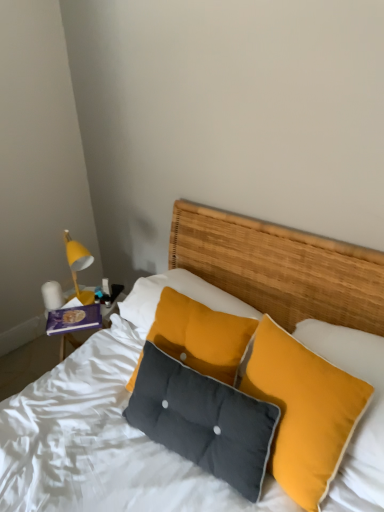
Question: Does white glossy lamp at left appear on the right side of dark gray fabric pillow at center, the second pillow when ordered from right to left?

Choices:
 (A) yes
 (B) no

Answer: (B)

Question: Considering the relative positions of white glossy lamp at left and dark gray fabric pillow at center, positioned as the first pillow in left-to-right order, in the image provided, is white glossy lamp at left in front of dark gray fabric pillow at center, positioned as the first pillow in left-to-right order,?

Choices:
 (A) yes
 (B) no

Answer: (B)

Question: Is dark gray fabric pillow at center, positioned as the first pillow in left-to-right order, at the back of white glossy lamp at left?

Choices:
 (A) yes
 (B) no

Answer: (B)

Question: Considering the relative positions of white glossy lamp at left and dark gray fabric pillow at center, positioned as the first pillow in left-to-right order, in the image provided, is white glossy lamp at left behind dark gray fabric pillow at center, positioned as the first pillow in left-to-right order,?

Choices:
 (A) yes
 (B) no

Answer: (A)

Question: Is white glossy lamp at left taller than dark gray fabric pillow at center, positioned as the first pillow in left-to-right order?

Choices:
 (A) no
 (B) yes

Answer: (A)

Question: From a real-world perspective, relative to textured yellow pillow at center, arranged as the first pillow when viewed from the right, is yellow matte lampshade at left vertically above or below?

Choices:
 (A) above
 (B) below

Answer: (A)

Question: Relative to textured yellow pillow at center, arranged as the first pillow when viewed from the right, is yellow matte lampshade at left in front or behind?

Choices:
 (A) behind
 (B) front

Answer: (A)

Question: Looking at their shapes, would you say yellow matte lampshade at left is wider or thinner than textured yellow pillow at center, arranged as the first pillow when viewed from the right?

Choices:
 (A) wide
 (B) thin

Answer: (B)

Question: From the image's perspective, is yellow matte lampshade at left positioned above or below textured yellow pillow at center, which ranks as the 2th pillow in left-to-right order?

Choices:
 (A) below
 (B) above

Answer: (B)

Question: Relative to yellow matte lampshade at left, is textured yellow pillow at center, which ranks as the 2th pillow in left-to-right order, in front or behind?

Choices:
 (A) front
 (B) behind

Answer: (A)

Question: Looking at the image, does textured yellow pillow at center, which ranks as the 2th pillow in left-to-right order, seem bigger or smaller compared to yellow matte lampshade at left?

Choices:
 (A) big
 (B) small

Answer: (A)

Question: Which is correct: textured yellow pillow at center, arranged as the first pillow when viewed from the right, is inside yellow matte lampshade at left, or outside of it?

Choices:
 (A) inside
 (B) outside

Answer: (B)

Question: Is textured yellow pillow at center, arranged as the first pillow when viewed from the right, wider or thinner than yellow matte lampshade at left?

Choices:
 (A) wide
 (B) thin

Answer: (A)

Question: Considering the positions of textured woven headboard at center and dark gray fabric pillow at center, positioned as the first pillow in left-to-right order, in the image, is textured woven headboard at center bigger or smaller than dark gray fabric pillow at center, positioned as the first pillow in left-to-right order,?

Choices:
 (A) big
 (B) small

Answer: (A)

Question: From their relative heights in the image, would you say textured woven headboard at center is taller or shorter than dark gray fabric pillow at center, positioned as the first pillow in left-to-right order?

Choices:
 (A) short
 (B) tall

Answer: (B)